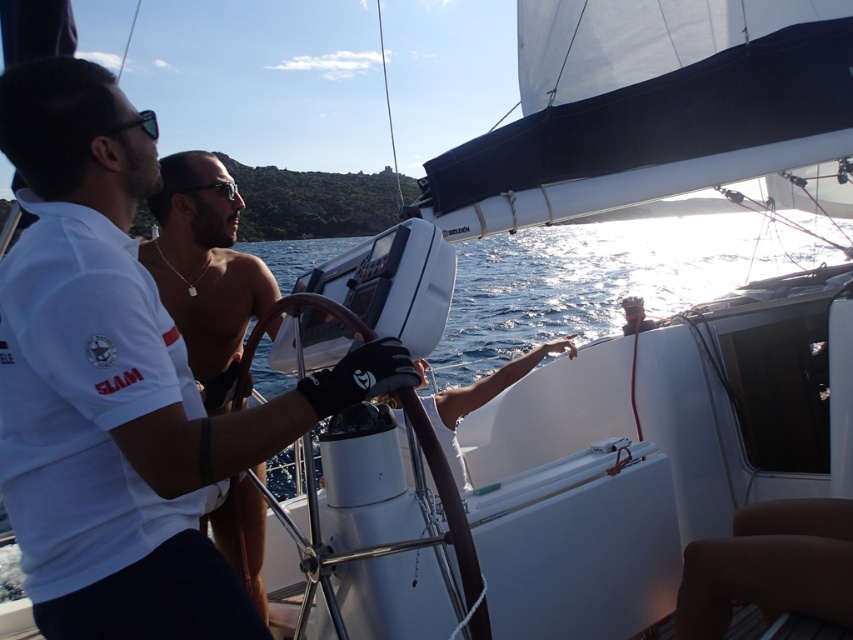
You are a photographer on the deck of the sailboat and want to take a closeup photo of the white matte shirt at center and the shiny black sunglasses at center. The camera you are using has a minimum focusing distance of 18 inches. Can you take the photo without moving either object?

The white matte shirt at center is 19.08 inches away from the shiny black sunglasses at center. Since the minimum focusing distance is 18 inches, the photographer can take the photo without moving either object because the distance between them is within the camera range.

You are navigating a sailboat and need to reach the white matte shirt at center quickly. Which direction should you move towards based on its position?

The white matte shirt at center is located at point (119, 385), so you should move towards the lower right direction to reach it quickly.

You are a photographer on the deck of the sailboat and want to take a photo of both the white matte shirt at center and the shiny black sunglasses at center. Which object should you focus on first if you want to ensure both are in sharp focus?

The white matte shirt at center is taller than the shiny black sunglasses at center, so focusing on the white matte shirt at center first would help ensure both are in sharp focus since it is the larger object.